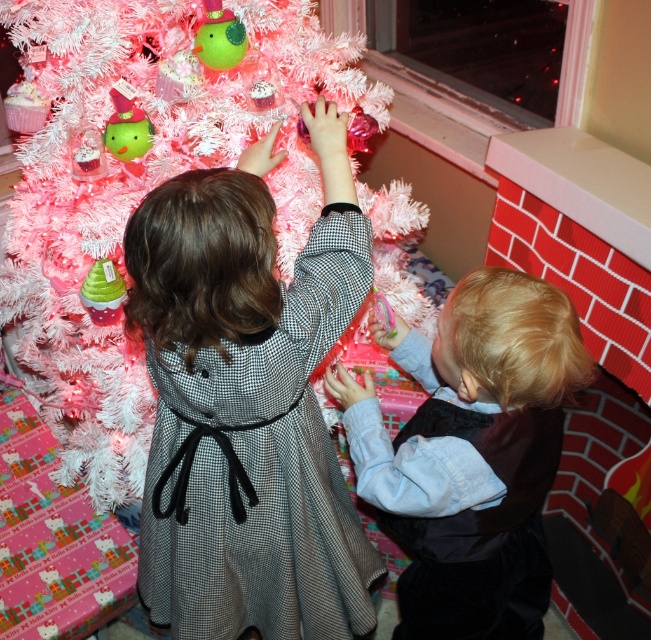
The height and width of the screenshot is (640, 651). Find the location of `white tinsel christmas tree at upper left`. white tinsel christmas tree at upper left is located at coordinates (143, 182).

Which of these two, white tinsel christmas tree at upper left or matte gray dress at center, stands taller?

With more height is white tinsel christmas tree at upper left.

This screenshot has height=640, width=651. Describe the element at coordinates (143, 182) in the screenshot. I see `white tinsel christmas tree at upper left` at that location.

Find the location of a particular element. The width and height of the screenshot is (651, 640). white tinsel christmas tree at upper left is located at coordinates (143, 182).

Which is above, matte gray dress at center or blonde hair at lower right?

Positioned higher is matte gray dress at center.

Is matte gray dress at center thinner than blonde hair at lower right?

In fact, matte gray dress at center might be wider than blonde hair at lower right.

What do you see at coordinates (247, 403) in the screenshot? I see `matte gray dress at center` at bounding box center [247, 403].

The height and width of the screenshot is (640, 651). I want to click on matte gray dress at center, so click(247, 403).

Is point (145, 22) behind point (501, 488)?

Yes.

Is point (309, 154) positioned in front of point (413, 362)?

No, (309, 154) is behind (413, 362).

Where is `white tinsel christmas tree at upper left`? This screenshot has width=651, height=640. white tinsel christmas tree at upper left is located at coordinates (143, 182).